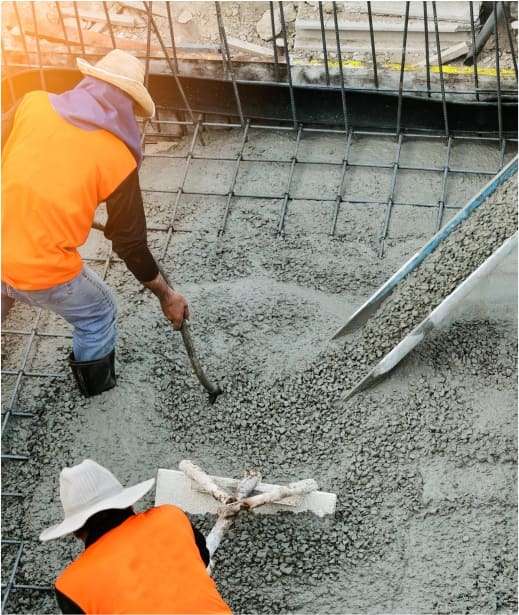
You are a GUI agent. You are given a task and a screenshot of the screen. Output one action in this format:
    pyautogui.click(x=<x>, y=<y>)
    Task: Click on the grate
    The height and width of the screenshot is (615, 519).
    Given the screenshot: What is the action you would take?
    pyautogui.click(x=289, y=175)